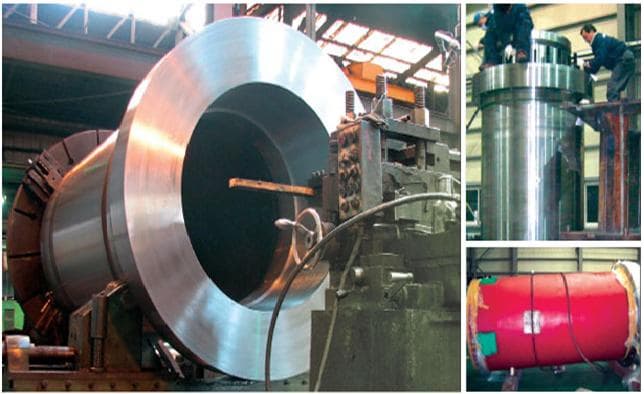
The width and height of the screenshot is (644, 394). I want to click on reflective surfaces, so click(x=543, y=141), click(x=261, y=52), click(x=98, y=151).